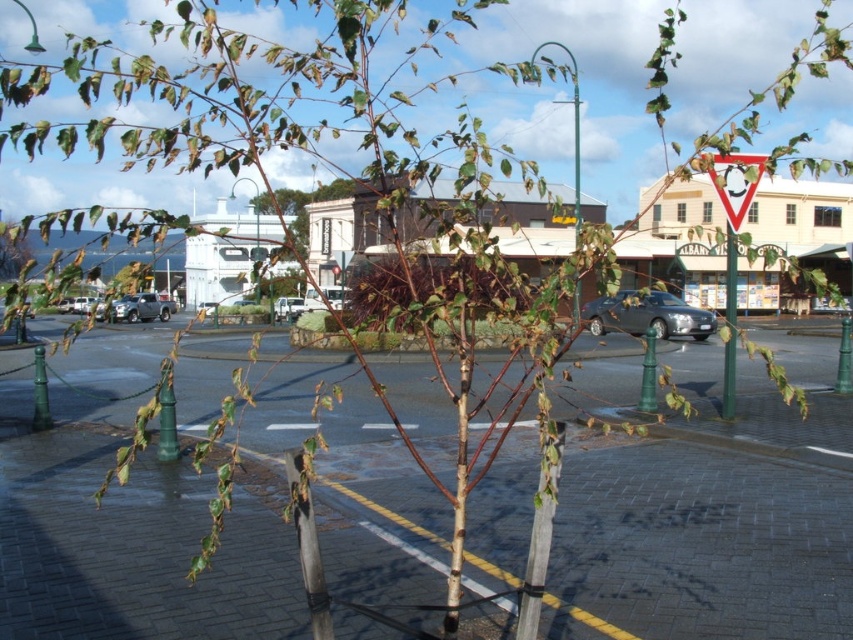
Who is taller, satin silver sedan at center or green metallic pole at center?

Standing taller between the two is green metallic pole at center.

Is satin silver sedan at center taller than green metallic pole at center?

No, satin silver sedan at center is not taller than green metallic pole at center.

Describe the element at coordinates (647, 316) in the screenshot. I see `satin silver sedan at center` at that location.

Image resolution: width=853 pixels, height=640 pixels. I want to click on satin silver sedan at center, so click(647, 316).

From the picture: Can you confirm if satin silver suv at center-left is positioned above green matte tree at upper left?

Actually, satin silver suv at center-left is below green matte tree at upper left.

Who is more distant from viewer, (x=136, y=321) or (x=24, y=241)?

The point (x=24, y=241) is behind.

Which is behind, point (120, 310) or point (3, 250)?

The point (120, 310) is behind.

I want to click on satin silver suv at center-left, so click(142, 307).

Does green metallic pole at center come in front of green matte tree at upper left?

No.

Between green metallic pole at center and green matte tree at upper left, which one appears on the right side from the viewer's perspective?

green metallic pole at center

Is point (573, 221) positioned behind point (9, 264)?

That is True.

The height and width of the screenshot is (640, 853). In order to click on green metallic pole at center in this screenshot , I will do `click(576, 148)`.